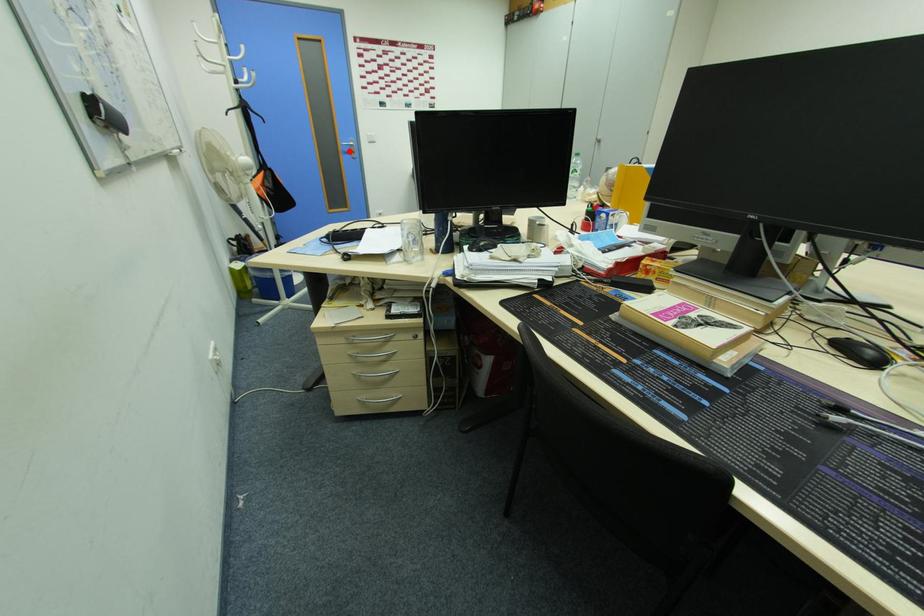
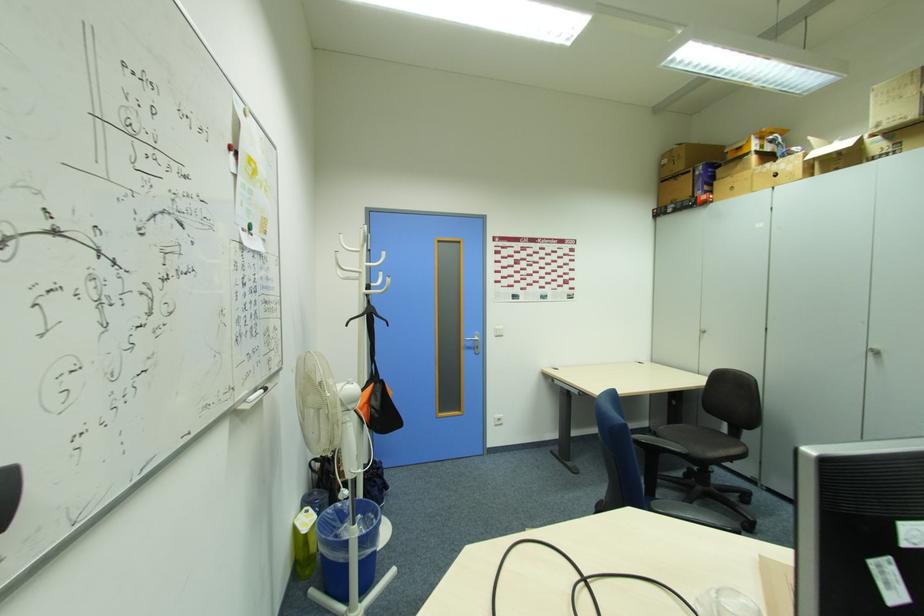
The point at the highlighted location is marked in the first image. Where is the corresponding point in the second image?

(472, 346)